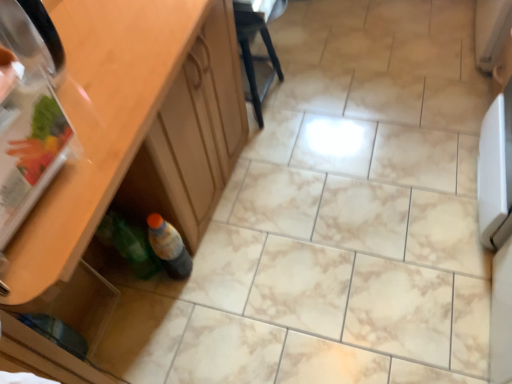
Question: Considering the positions of translucent plastic bottle at lower left, arranged as the first bottle when viewed from the right, and green plastic bottle at lower left, acting as the 2th bottle starting from the right, in the image, is translucent plastic bottle at lower left, arranged as the first bottle when viewed from the right, wider or thinner than green plastic bottle at lower left, acting as the 2th bottle starting from the right,?

Choices:
 (A) wide
 (B) thin

Answer: (B)

Question: Based on their positions, is translucent plastic bottle at lower left, arranged as the first bottle when viewed from the right, located to the left or right of green plastic bottle at lower left, acting as the 2th bottle starting from the right?

Choices:
 (A) left
 (B) right

Answer: (B)

Question: Which object is the farthest from the transparent plastic drawer at lower left?

Choices:
 (A) wooden cabinet at lower left
 (B) translucent plastic bottle at lower left, the second bottle viewed from the left
 (C) black plastic chair at center
 (D) green plastic bottle at lower left, which ranks as the first bottle in left-to-right order

Answer: (C)

Question: Which object is the closest to the wooden cabinet at lower left?

Choices:
 (A) transparent plastic drawer at lower left
 (B) green plastic bottle at lower left, acting as the 2th bottle starting from the right
 (C) translucent plastic bottle at lower left, the second bottle viewed from the left
 (D) black plastic chair at center

Answer: (C)